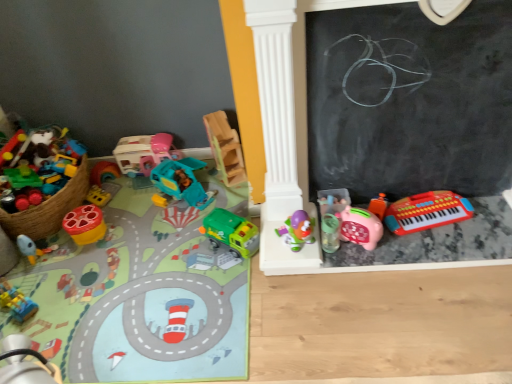
The width and height of the screenshot is (512, 384). I want to click on free space in front of teal plastic car at center, marked as the 7th toy in a right-to-left arrangement, so click(x=169, y=226).